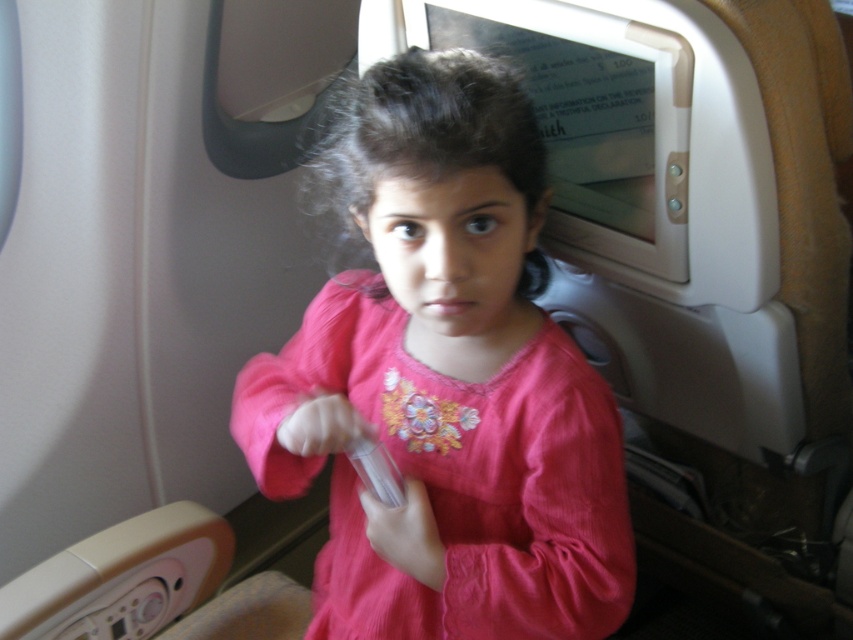
You are a flight attendant standing at the back of the airplane cabin. You need to reach the point at coordinates point (560, 561) which is 33.45 inches away from the viewer. Can you safely walk towards it without any obstruction?

The point (560, 561) is 33.45 inches away from the viewer, so yes, you can safely walk towards it as there are no obstructions mentioned in the scene description.

The young girl in the airplane cabin is wearing a pink cotton shirt at center and holding a clear plastic remote at center. Which item is closer to the viewer?

The pink cotton shirt at center is closer to the viewer because it is positioned over the clear plastic remote at center.

You are a flight attendant checking the seating area. You see the pink cotton shirt at center and the clear plastic remote at center. How far apart are these two items?

The pink cotton shirt at center and the clear plastic remote at center are 7.34 inches apart from each other.